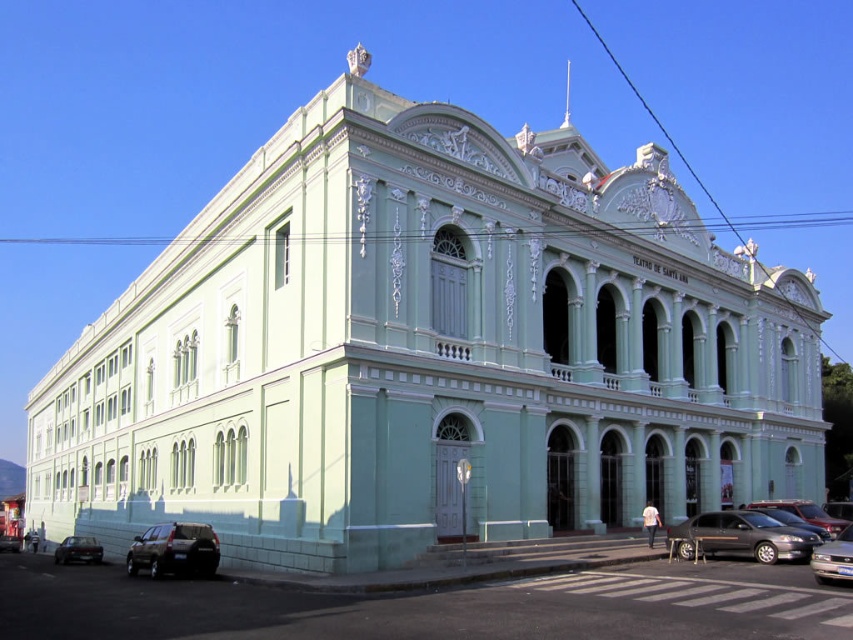
Who is higher up, matte black sedan at lower right or shiny black car at lower left?

Positioned higher is matte black sedan at lower right.

Does point (775, 547) come farther from viewer compared to point (18, 548)?

No, (775, 547) is in front of (18, 548).

Is point (781, 557) positioned before point (12, 536)?

Yes, it is.

You are a GUI agent. You are given a task and a screenshot of the screen. Output one action in this format:
    pyautogui.click(x=<x>, y=<y>)
    Task: Click on the matte black sedan at lower right
    The image size is (853, 640).
    Given the screenshot: What is the action you would take?
    pyautogui.click(x=741, y=536)

Is shiny black suv at lower left thinner than dark gray metallic car at lower left?

Yes, shiny black suv at lower left is thinner than dark gray metallic car at lower left.

Is shiny black suv at lower left to the right of dark gray metallic car at lower left from the viewer's perspective?

Yes, shiny black suv at lower left is to the right of dark gray metallic car at lower left.

Locate an element on the screen. The width and height of the screenshot is (853, 640). shiny black suv at lower left is located at coordinates (173, 550).

Looking at this image, how much distance is there between dark gray metallic car at lower left and shiny black car at lower left?

They are 28.37 meters apart.

Can you confirm if dark gray metallic car at lower left is bigger than shiny black car at lower left?

Yes, dark gray metallic car at lower left is bigger than shiny black car at lower left.

Locate an element on the screen. The height and width of the screenshot is (640, 853). dark gray metallic car at lower left is located at coordinates (78, 550).